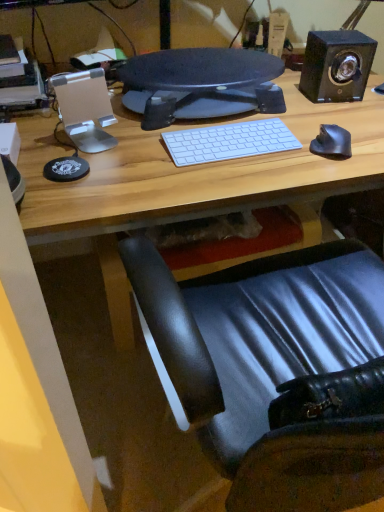
What do you see at coordinates (275, 370) in the screenshot? I see `black leather chair at lower right` at bounding box center [275, 370].

Where is `white matte keyboard at center`? The width and height of the screenshot is (384, 512). white matte keyboard at center is located at coordinates (229, 141).

From their relative heights in the image, would you say matte black monitor at center is taller or shorter than black glossy speaker at upper right?

Considering their sizes, matte black monitor at center has less height than black glossy speaker at upper right.

Is matte black monitor at center oriented towards black glossy speaker at upper right?

No, matte black monitor at center is not facing towards black glossy speaker at upper right.

Are matte black monitor at center and black glossy speaker at upper right making contact?

No, matte black monitor at center is not next to black glossy speaker at upper right.

Which object is more forward, white matte keyboard at center or black rubberized mouse at right?

Positioned in front is white matte keyboard at center.

Does point (225, 158) appear closer or farther from the camera than point (313, 148)?

Point (225, 158) appears to be closer to the viewer than point (313, 148).

Is white matte keyboard at center facing away from black rubberized mouse at right?

No, white matte keyboard at center is not facing the opposite direction of black rubberized mouse at right.

Consider the image. Considering the sizes of objects white matte keyboard at center and black rubberized mouse at right in the image provided, who is wider, white matte keyboard at center or black rubberized mouse at right?

white matte keyboard at center.

Is black rubberized mouse at right surrounded by black glossy speaker at upper right?

No, black rubberized mouse at right is not surrounded by black glossy speaker at upper right.

What's the angular difference between black glossy speaker at upper right and black rubberized mouse at right's facing directions?

15.7 degrees separate the facing orientations of black glossy speaker at upper right and black rubberized mouse at right.

Is black glossy speaker at upper right far from black rubberized mouse at right?

That's not correct — black glossy speaker at upper right is a little close to black rubberized mouse at right.

Who is shorter, black glossy speaker at upper right or black rubberized mouse at right?

black rubberized mouse at right.

Could you tell me if black rubberized mouse at right is turned towards black glossy speaker at upper right?

No, black rubberized mouse at right is not aimed at black glossy speaker at upper right.

Are black rubberized mouse at right and black glossy speaker at upper right beside each other?

black rubberized mouse at right and black glossy speaker at upper right are clearly separated.

From the image's perspective, which is above, black rubberized mouse at right or black glossy speaker at upper right?

black glossy speaker at upper right.

Does white matte keyboard at center turn towards black glossy speaker at upper right?

No, white matte keyboard at center is not facing towards black glossy speaker at upper right.

Is white matte keyboard at center situated inside black glossy speaker at upper right or outside?

white matte keyboard at center is located beyond the bounds of black glossy speaker at upper right.

What's the angular difference between white matte keyboard at center and black glossy speaker at upper right's facing directions?

The angle between the facing direction of white matte keyboard at center and the facing direction of black glossy speaker at upper right is 8.13 degrees.

Can you confirm if white matte keyboard at center is taller than black glossy speaker at upper right?

Incorrect, the height of white matte keyboard at center is not larger of that of black glossy speaker at upper right.

Does black leather chair at lower right touch black rubberized mouse at right?

No, black leather chair at lower right is not making contact with black rubberized mouse at right.

From the picture: From the image's perspective, which object appears higher, black leather chair at lower right or black rubberized mouse at right?

black rubberized mouse at right.

Between black leather chair at lower right and black rubberized mouse at right, which one is positioned in front?

Positioned in front is black leather chair at lower right.

Can you confirm if black leather chair at lower right is shorter than black rubberized mouse at right?

No.

Is white matte keyboard at center positioned with its back to black leather chair at lower right?

No, black leather chair at lower right is not at the back of white matte keyboard at center.

From a real-world perspective, is white matte keyboard at center under black leather chair at lower right?

No, from a real-world perspective, white matte keyboard at center is not under black leather chair at lower right.

Which of these two, white matte keyboard at center or black leather chair at lower right, stands taller?

black leather chair at lower right is taller.

Find the location of a particular element. computer monitor that appears below the black glossy speaker at upper right (from the image's perspective) is located at coordinates (205, 81).

Identify the location of computer keyboard located above the black rubberized mouse at right (from the image's perspective). This screenshot has height=512, width=384. click(x=229, y=141).

Based on their spatial positions, is black rubberized mouse at right or white matte keyboard at center further from black glossy speaker at upper right?

Based on the image, white matte keyboard at center appears to be further to black glossy speaker at upper right.

Based on the photo, which object lies nearer to the anchor point black glossy speaker at upper right, matte black monitor at center or black leather chair at lower right?

Among the two, matte black monitor at center is located nearer to black glossy speaker at upper right.

Considering their positions, is black rubberized mouse at right positioned closer to matte black monitor at center than black glossy speaker at upper right?

Based on the image, black glossy speaker at upper right appears to be nearer to matte black monitor at center.

From the image, which object appears to be farther from black leather chair at lower right, black rubberized mouse at right or matte black monitor at center?

matte black monitor at center is further to black leather chair at lower right.

Considering their positions, is white matte keyboard at center positioned further to matte black monitor at center than black leather chair at lower right?

black leather chair at lower right is positioned further to the anchor matte black monitor at center.

Looking at the image, which one is located further to matte black monitor at center, black leather chair at lower right or black rubberized mouse at right?

Among the two, black leather chair at lower right is located further to matte black monitor at center.

Which object lies further to the anchor point black rubberized mouse at right, black glossy speaker at upper right or white matte keyboard at center?

Based on the image, black glossy speaker at upper right appears to be further to black rubberized mouse at right.

Estimate the real-world distances between objects in this image. Which object is closer to black leather chair at lower right, black glossy speaker at upper right or matte black monitor at center?

Based on the image, matte black monitor at center appears to be nearer to black leather chair at lower right.

The image size is (384, 512). Identify the location of mouse between white matte keyboard at center and black glossy speaker at upper right in the horizontal direction. (332, 142).

Where is `computer keyboard between black glossy speaker at upper right and black leather chair at lower right from top to bottom`? computer keyboard between black glossy speaker at upper right and black leather chair at lower right from top to bottom is located at coordinates (229, 141).

You are a GUI agent. You are given a task and a screenshot of the screen. Output one action in this format:
    pyautogui.click(x=<x>, y=<y>)
    Task: Click on the mouse between matte black monitor at center and black glossy speaker at upper right from left to right
    The height and width of the screenshot is (512, 384).
    Given the screenshot: What is the action you would take?
    pyautogui.click(x=332, y=142)

Image resolution: width=384 pixels, height=512 pixels. What are the coordinates of `mouse between matte black monitor at center and black leather chair at lower right vertically` in the screenshot? It's located at (332, 142).